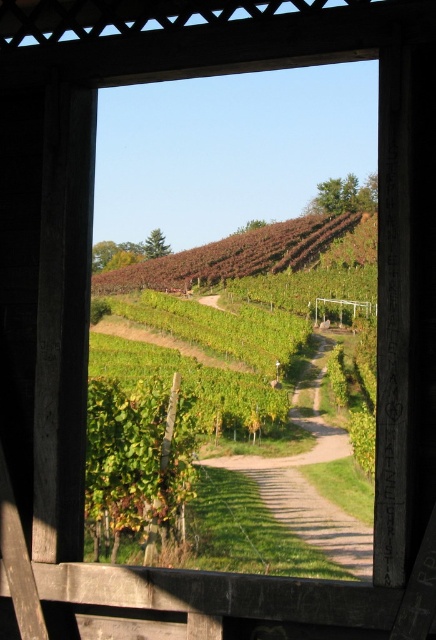
Between green grassy path at center and brown leafy hillside at upper center, which one appears on the right side from the viewer's perspective?

brown leafy hillside at upper center is more to the right.

How distant is green grassy path at center from brown leafy hillside at upper center?

green grassy path at center and brown leafy hillside at upper center are 50.59 meters apart.

Which is behind, point (364, 577) or point (276, 268)?

Point (276, 268)

What are the coordinates of `green grassy path at center` in the screenshot? It's located at (309, 481).